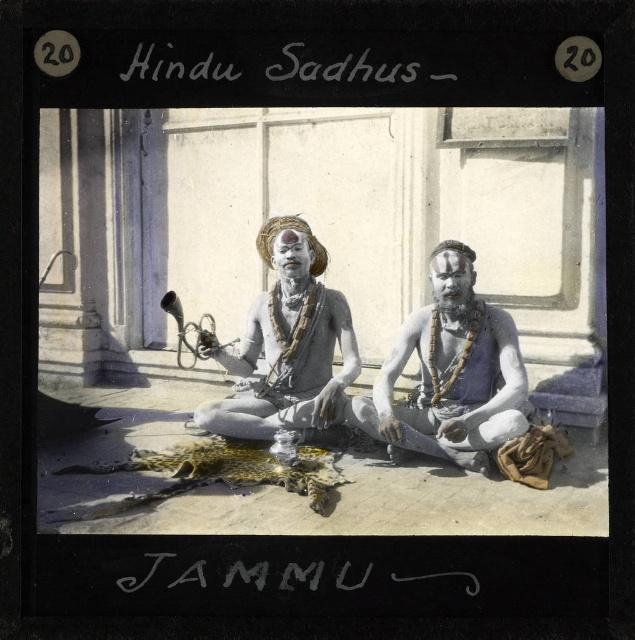
Is point (464, 300) more distant than point (290, 250)?

That is False.

Between point (389, 432) and point (260, 417), which one is positioned behind?

Positioned behind is point (260, 417).

Which is behind, point (439, 365) or point (298, 372)?

The point (298, 372) is more distant.

What are the coordinates of `white matte man at center` in the screenshot? It's located at (451, 372).